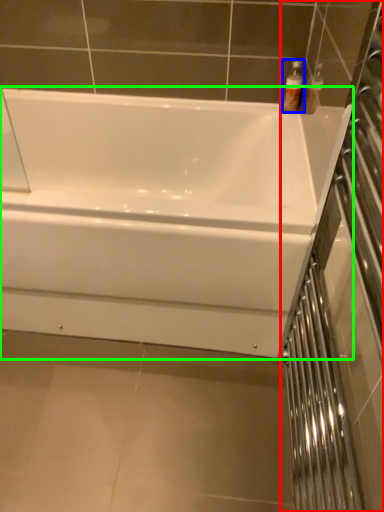
Question: Based on their relative distances, which object is nearer to screen door (highlighted by a red box)? Choose from toiletry (highlighted by a blue box) and bathtub (highlighted by a green box).

Choices:
 (A) toiletry
 (B) bathtub

Answer: (B)